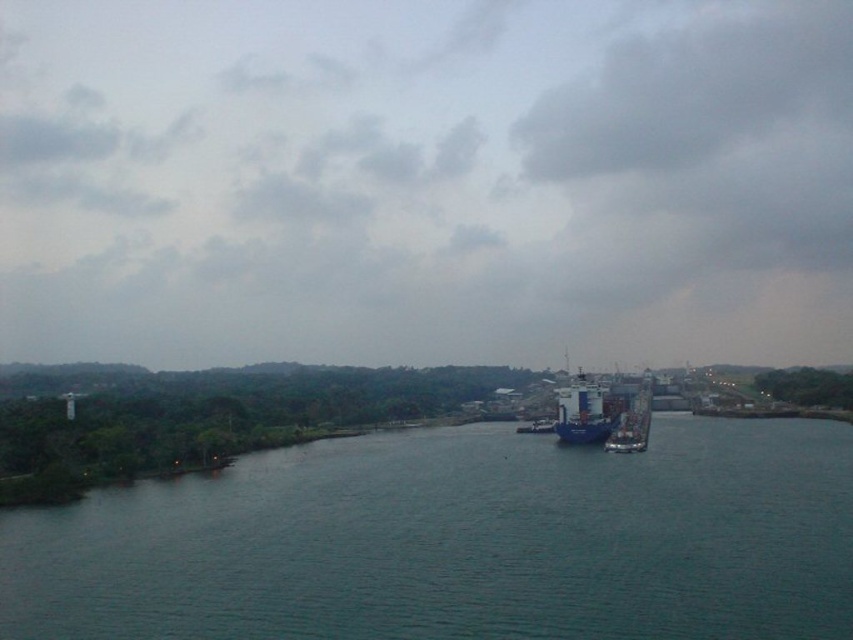
Which is behind, point (393, 465) or point (573, 392)?

Positioned behind is point (573, 392).

Who is lower down, dark blue water at center or blue matte container ship at center?

dark blue water at center is lower down.

Find the location of `dark blue water at center`. dark blue water at center is located at coordinates (457, 541).

Does blue matte container ship at center have a greater height compared to blue metallic cargo ship at center?

Yes.

Can you confirm if blue matte container ship at center is bigger than blue metallic cargo ship at center?

Actually, blue matte container ship at center might be smaller than blue metallic cargo ship at center.

Is point (567, 384) farther from viewer compared to point (631, 429)?

Yes, point (567, 384) is behind point (631, 429).

The image size is (853, 640). I want to click on blue matte container ship at center, so click(x=582, y=412).

Is point (610, 490) positioned before point (645, 400)?

Yes.

What do you see at coordinates (457, 541) in the screenshot? The image size is (853, 640). I see `dark blue water at center` at bounding box center [457, 541].

Identify the location of dark blue water at center. (457, 541).